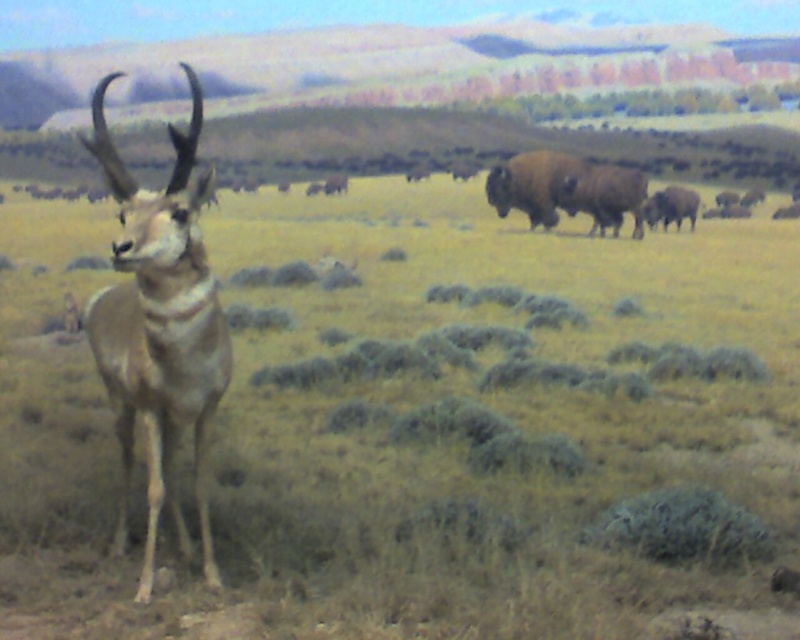
Question: Can you confirm if green grassy at center is smaller than brown textured bison at center-right?

Choices:
 (A) no
 (B) yes

Answer: (A)

Question: Which point appears farthest from the camera in this image?

Choices:
 (A) tap(492, 244)
 (B) tap(666, 224)
 (C) tap(488, 179)

Answer: (B)

Question: Based on their relative distances, which object is nearer to the green grassy at center?

Choices:
 (A) brown textured bison at center-right
 (B) brown furry yak at right
 (C) light brown fur antelope at left

Answer: (B)

Question: Does green grassy at center have a smaller size compared to brown furry yak at right?

Choices:
 (A) no
 (B) yes

Answer: (A)

Question: Estimate the real-world distances between objects in this image. Which object is closer to the green grassy at center?

Choices:
 (A) brown textured bison at center-right
 (B) light brown fur antelope at left

Answer: (B)

Question: Is the position of light brown fur antelope at left more distant than that of brown textured bison at center-right?

Choices:
 (A) yes
 (B) no

Answer: (B)